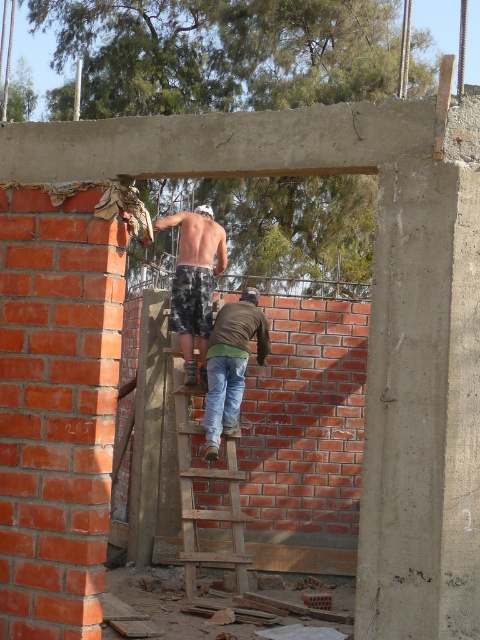
Does wooden at center lie behind jeans at center?

No, it is not.

Measure the distance between wooden at center and camera.

wooden at center is 7.39 meters away from camera.

Identify the location of wooden at center. (207, 508).

Identify the location of wooden at center. (207, 508).

Measure the distance from wooden at center to camo shorts at center.

wooden at center and camo shorts at center are 33.12 inches apart from each other.

Which is behind, point (226, 467) or point (211, 273)?

Positioned behind is point (211, 273).

Image resolution: width=480 pixels, height=640 pixels. In order to click on wooden at center in this screenshot , I will do `click(207, 508)`.

Identify the location of wooden at center. The height and width of the screenshot is (640, 480). (207, 508).

Who is more distant from viewer, (176, 305) or (225, 340)?

Point (176, 305)

In the scene shown: Between camo shorts at center and jeans at center, which one appears on the right side from the viewer's perspective?

jeans at center is more to the right.

Does point (179, 326) lie in front of point (230, 348)?

No, (179, 326) is behind (230, 348).

This screenshot has height=640, width=480. Identify the location of camo shorts at center. (194, 282).